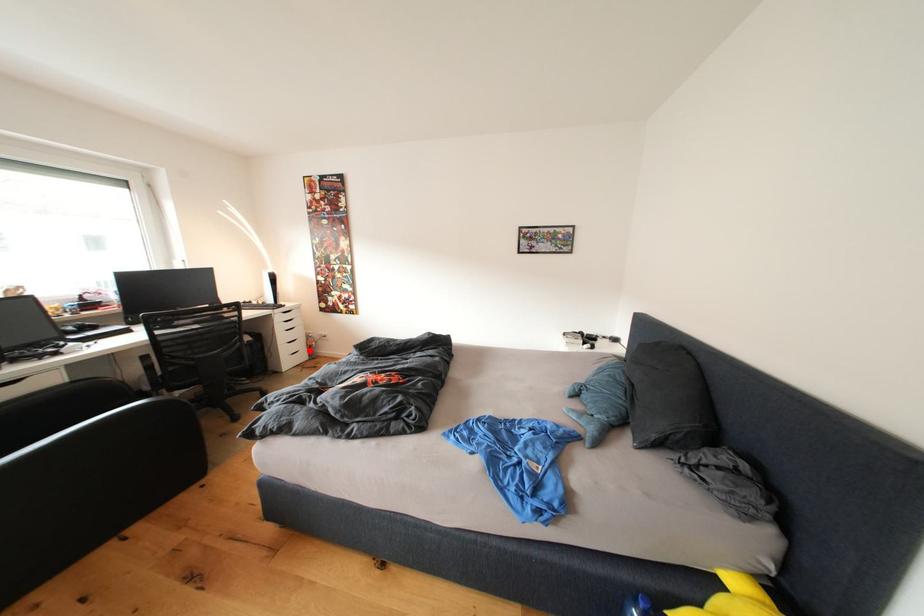
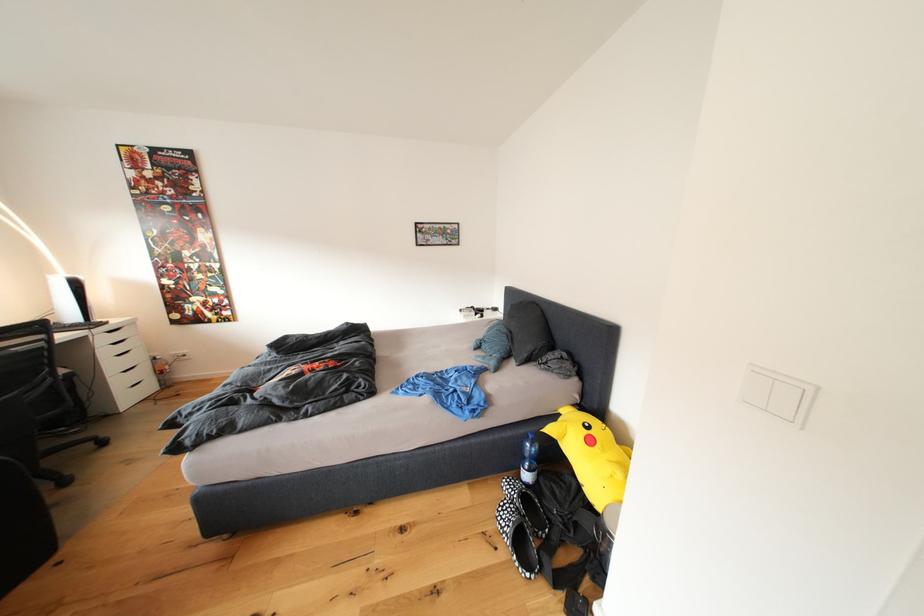
Question: I am providing you with two images of the same scene from different viewpoints. Given a red point in image1, look at the same physical point in image2. Is it:

Choices:
 (A) Closer to the viewpoint
 (B) Farther from the viewpoint

Answer: (A)